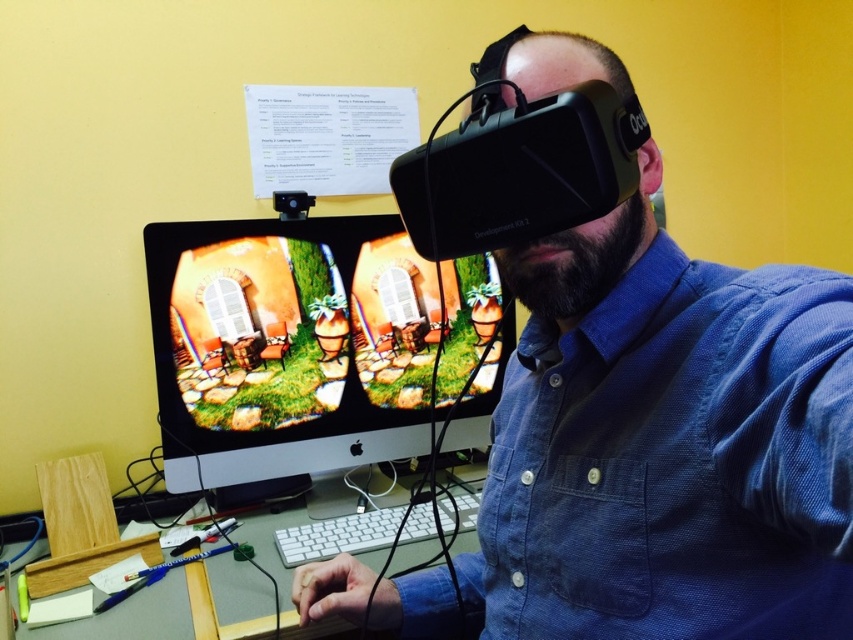
Consider the image. Which is above, wooden at lower center or white plastic keyboard at center?

white plastic keyboard at center

Does point (287, 572) come closer to viewer compared to point (404, 529)?

Yes, point (287, 572) is in front of point (404, 529).

Where is `wooden at lower center`? wooden at lower center is located at coordinates (231, 602).

Identify the location of wooden at lower center. Image resolution: width=853 pixels, height=640 pixels. (231, 602).

Who is taller, black matte vr headset at center or wooden at lower center?

Standing taller between the two is black matte vr headset at center.

Which is in front, point (665, 545) or point (260, 552)?

Point (665, 545) is in front.

Is point (579, 433) closer to viewer compared to point (248, 525)?

That is True.

Locate an element on the screen. The height and width of the screenshot is (640, 853). black matte vr headset at center is located at coordinates (657, 451).

Between point (548, 614) and point (341, 536), which one is positioned behind?

Point (341, 536)

The height and width of the screenshot is (640, 853). In order to click on black matte vr headset at center in this screenshot , I will do `click(657, 451)`.